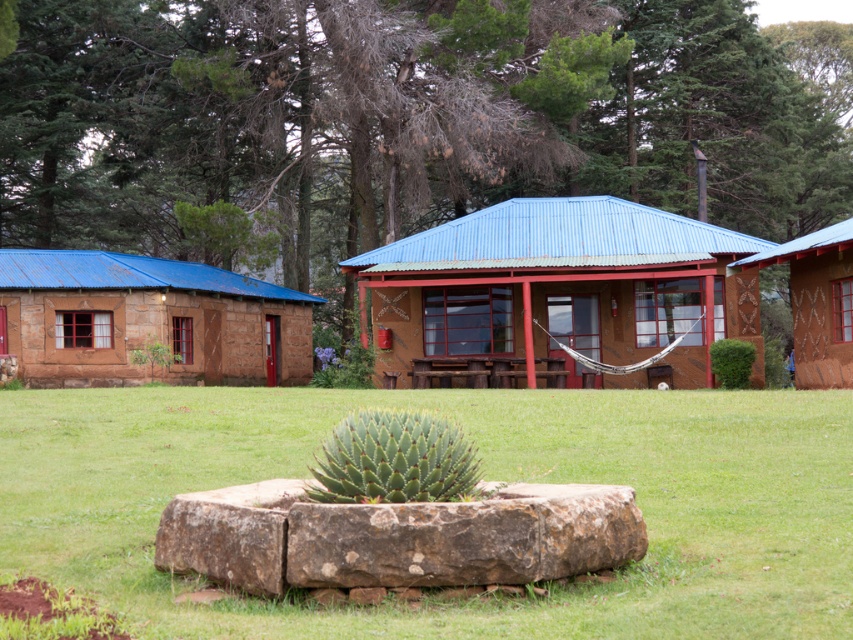
Question: Can you confirm if brown rough stone at center is thinner than brown textured cabin at right?

Choices:
 (A) yes
 (B) no

Answer: (B)

Question: From the image, what is the correct spatial relationship of brown rough stone at center in relation to rustic stone cabin at left?

Choices:
 (A) below
 (B) above

Answer: (A)

Question: Is green grass at center bigger than brown clay cabin at center?

Choices:
 (A) yes
 (B) no

Answer: (B)

Question: Which point is farther to the camera?

Choices:
 (A) (821, 364)
 (B) (4, 298)
 (C) (558, 595)
 (D) (437, 516)

Answer: (B)

Question: Which is nearer to the brown clay cabin at center?

Choices:
 (A) green grass at center
 (B) brown rough stone at center

Answer: (A)

Question: Which object is the farthest from the brown rough stone at center?

Choices:
 (A) brown clay cabin at center
 (B) rustic stone cabin at left
 (C) green grass at center
 (D) brown textured cabin at right

Answer: (B)